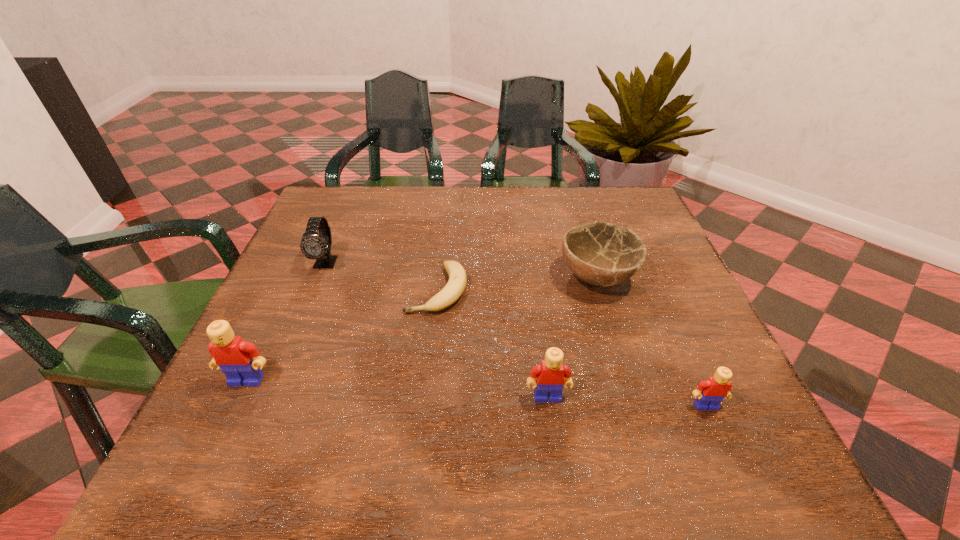
Locate an element on the screen. The height and width of the screenshot is (540, 960). vacant space at the near edge is located at coordinates (562, 402).

Where is `free space at the left edge of the desktop`? Image resolution: width=960 pixels, height=540 pixels. free space at the left edge of the desktop is located at coordinates (305, 265).

The height and width of the screenshot is (540, 960). In order to click on blank space at the far left corner of the desktop in this screenshot , I will do `click(304, 229)`.

In the image, there is a desktop. Identify the location of vacant space at the far right corner. (614, 215).

At what (x,y) coordinates should I click in order to perform the action: click on vacant space at the near right corner of the desktop. Please return your answer as a coordinate pair (x, y). Looking at the image, I should click on (678, 390).

You are a GUI agent. You are given a task and a screenshot of the screen. Output one action in this format:
    pyautogui.click(x=<x>, y=<y>)
    Task: Click on the vacant region between the rightmost object and the shortest object
    The image size is (960, 540).
    Given the screenshot: What is the action you would take?
    pyautogui.click(x=571, y=348)

The height and width of the screenshot is (540, 960). I want to click on vacant area that lies between the fourth farthest object and the third object from right to left, so click(x=397, y=389).

The width and height of the screenshot is (960, 540). I want to click on unoccupied area between the shortest object and the rightmost object, so click(571, 348).

The image size is (960, 540). Identify the location of vacant point located between the fifth object from left to right and the rightmost Lego. (652, 342).

Where is `empty location between the shortest object and the second Lego from left to right`? empty location between the shortest object and the second Lego from left to right is located at coordinates (492, 343).